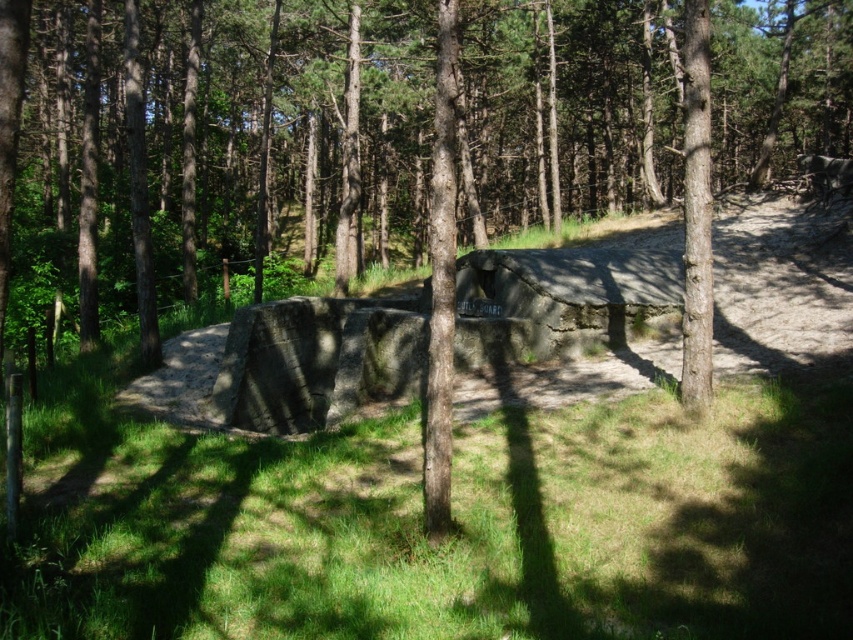
Question: Does brown rough tree at center have a larger size compared to green grass at center?

Choices:
 (A) no
 (B) yes

Answer: (B)

Question: Which of the following is the closest to the observer?

Choices:
 (A) green grass at center
 (B) brown rough tree at center

Answer: (A)

Question: Is brown rough tree at center behind green grass at center?

Choices:
 (A) yes
 (B) no

Answer: (A)

Question: Which of the following is the closest to the observer?

Choices:
 (A) brown rough tree at center
 (B) green grass at center

Answer: (B)

Question: In this image, where is brown rough tree at center located relative to green grass at center?

Choices:
 (A) above
 (B) below

Answer: (A)